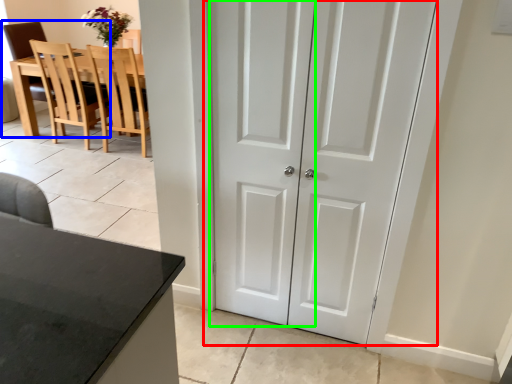
Question: Which object is the farthest from door (highlighted by a red box)? Choose among these: chair (highlighted by a blue box) or screen door (highlighted by a green box).

Choices:
 (A) chair
 (B) screen door

Answer: (A)